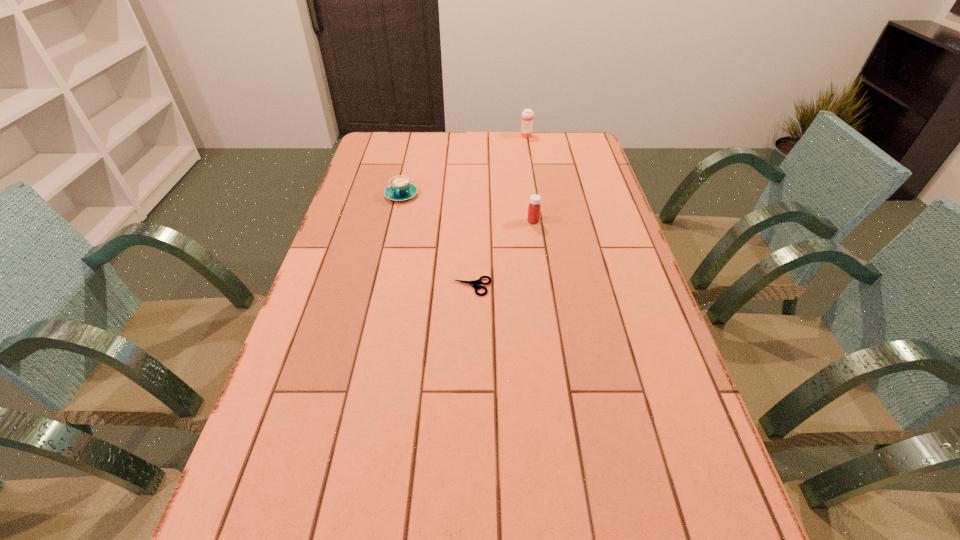
Locate an element on the screen. The image size is (960, 540). the farthest object is located at coordinates (527, 115).

Image resolution: width=960 pixels, height=540 pixels. What are the coordinates of `the taller medicine` in the screenshot? It's located at click(527, 115).

I want to click on the second nearest object, so click(534, 207).

Where is `the second tallest object`? the second tallest object is located at coordinates (534, 207).

At what (x,y) coordinates should I click in order to perform the action: click on the third nearest object. Please return your answer as a coordinate pair (x, y). The height and width of the screenshot is (540, 960). Looking at the image, I should click on (400, 189).

Image resolution: width=960 pixels, height=540 pixels. In order to click on the leftmost object in this screenshot , I will do `click(400, 189)`.

Where is `the third object from right to left`? the third object from right to left is located at coordinates (474, 283).

In order to click on shears in this screenshot , I will do `click(474, 283)`.

You are a GUI agent. You are given a task and a screenshot of the screen. Output one action in this format:
    pyautogui.click(x=<x>, y=<y>)
    Task: Click on the vacant region located 0.290m on the left of the tallest object
    
    Given the screenshot: What is the action you would take?
    pyautogui.click(x=448, y=136)

Find the location of `free space located on the front of the shorter medicine`. free space located on the front of the shorter medicine is located at coordinates (546, 312).